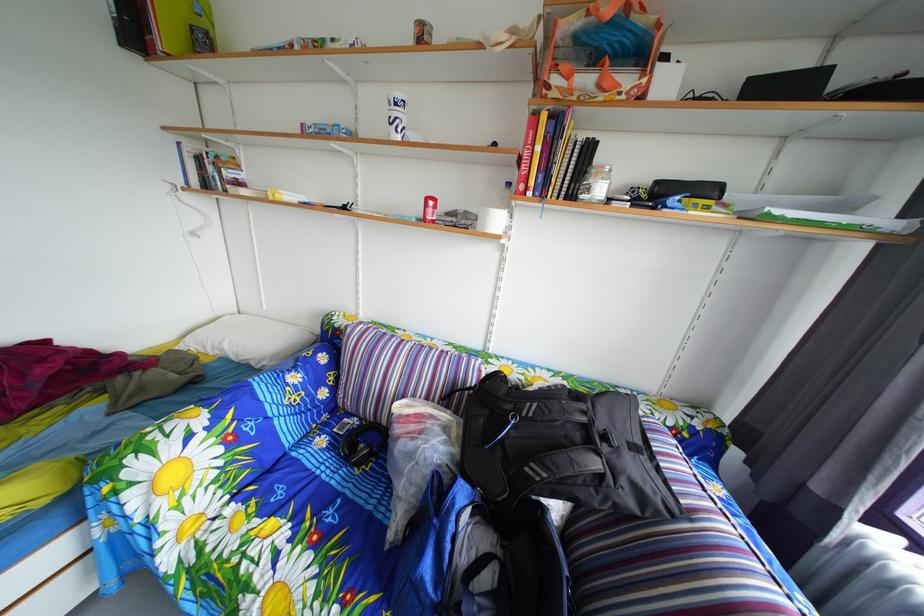
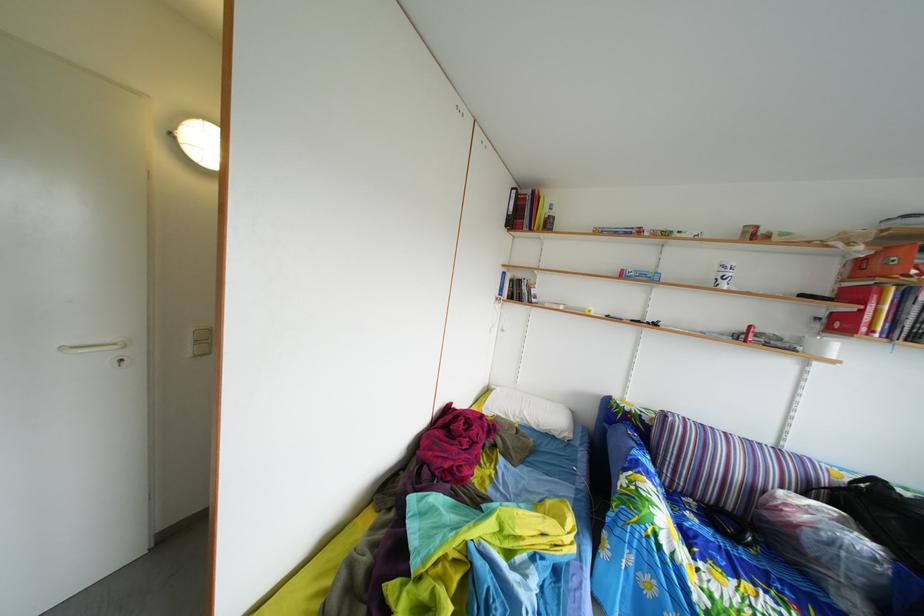
What movement of the cameraman would produce the second image?

The cameraman moved toward left, backward.